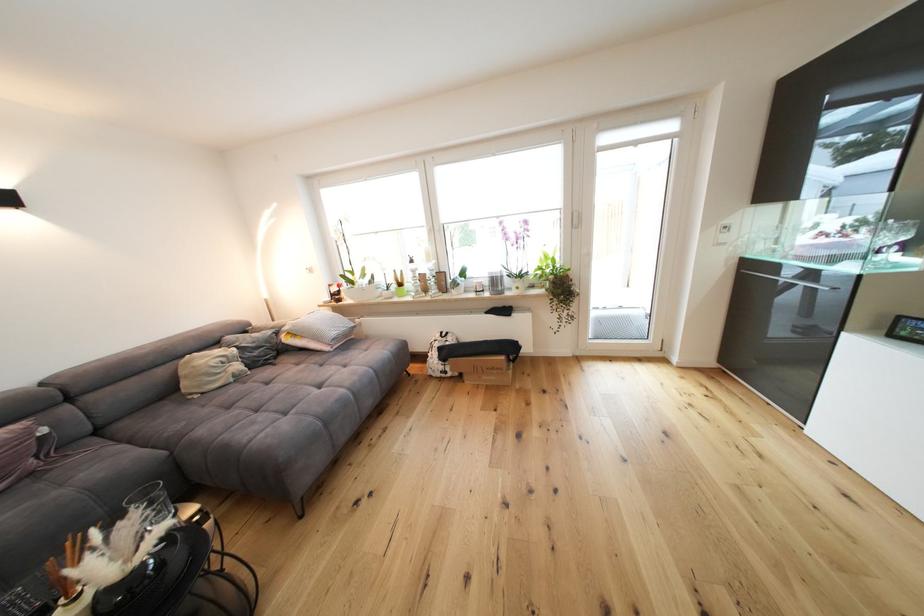
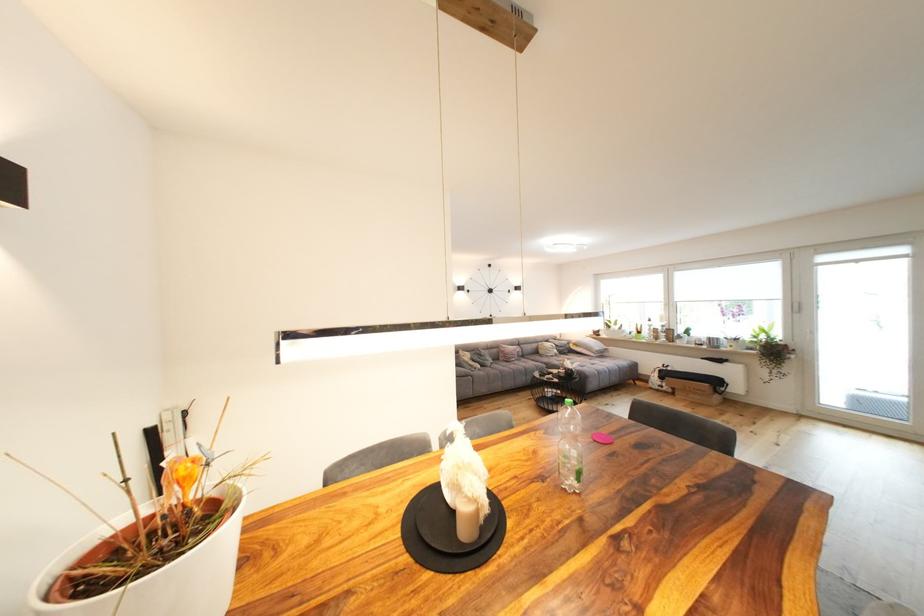
The point at (341, 334) is marked in the first image. Where is the corresponding point in the second image?

(603, 350)